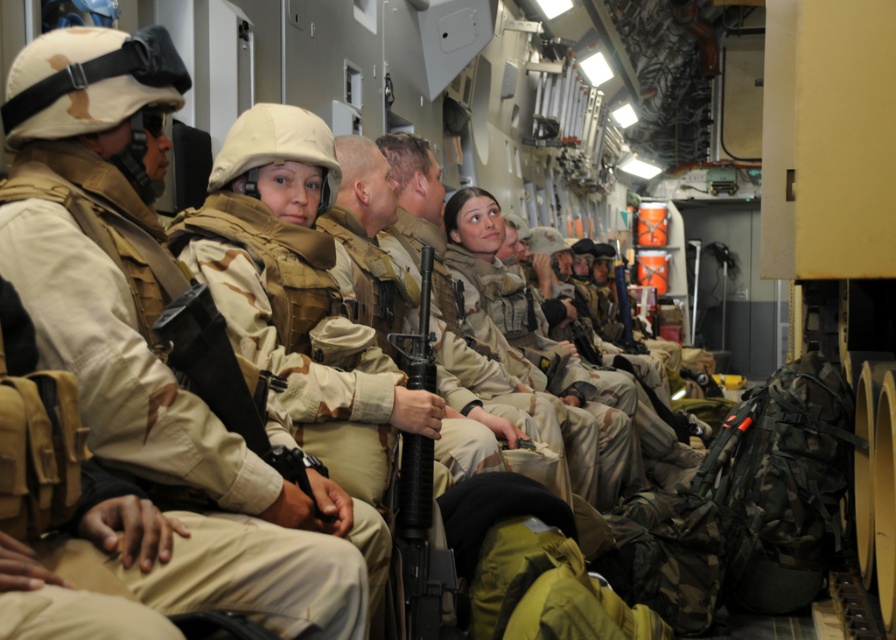
Is point (138, 577) positioned after point (429, 499)?

No, it is in front of (429, 499).

Who is taller, camouflage uniform at left or black matte rifle at center?

With more height is camouflage uniform at left.

What do you see at coordinates (158, 340) in the screenshot? I see `camouflage uniform at left` at bounding box center [158, 340].

What are the coordinates of `camouflage uniform at left` in the screenshot? It's located at (158, 340).

Between camouflage uniform at left and matte black rifle at center, which one has less height?

matte black rifle at center is shorter.

Is point (20, 214) closer to viewer compared to point (173, 326)?

Yes, point (20, 214) is in front of point (173, 326).

Between point (85, 120) and point (214, 317), which one is positioned in front?

Point (214, 317)

Where is `camouflage uniform at left`? The width and height of the screenshot is (896, 640). camouflage uniform at left is located at coordinates (158, 340).

In the scene shown: Does black matte rifle at center have a smaller size compared to matte black rifle at center?

Actually, black matte rifle at center might be larger than matte black rifle at center.

Can you confirm if black matte rifle at center is shorter than matte black rifle at center?

No.

Image resolution: width=896 pixels, height=640 pixels. Identify the location of black matte rifle at center. (420, 545).